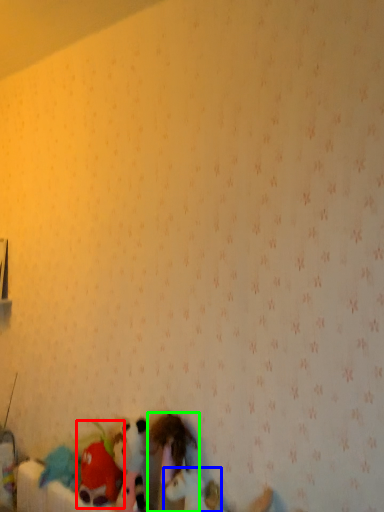
Question: Which is nearer to the toy (highlighted by a red box)? toy (highlighted by a blue box) or toy (highlighted by a green box).

Choices:
 (A) toy
 (B) toy

Answer: (B)